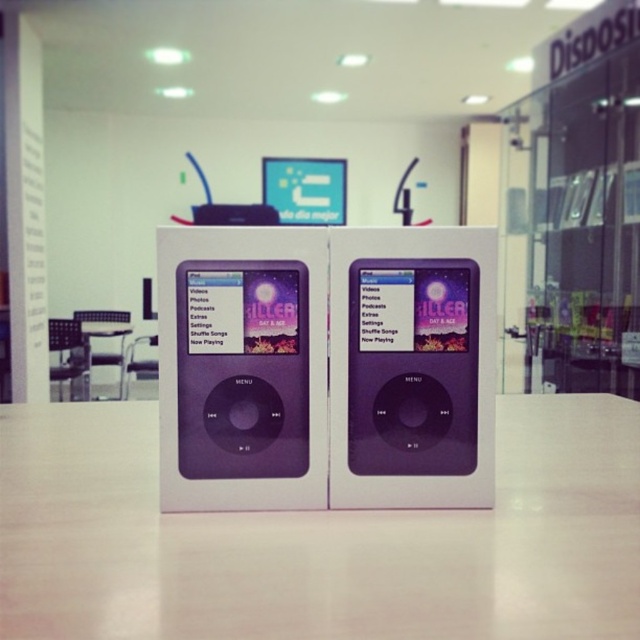
You are a delivery person who just received a package containing a purple glossy ipod at center and a white glossy table at lower center. You need to place both items on a shelf. Which item should you place first to ensure proper positioning according to the image?

The purple glossy ipod at center is above the white glossy table at lower center in the image, so you should place the white glossy table at lower center first on the shelf to replicate the positioning correctly.

You are setting up a display and need to place a decorative mat that is 12 inches wide. You have the white matte table at center and the purple glossy ipod at center in view. Which object can the mat fit over without overhanging?

The white matte table at center is wider than the purple glossy ipod at center. Since the mat is 12 inches wide, it can fit over the white matte table at center as it has sufficient width.

You are setting up a display for an electronics store and need to stack items vertically. You have a purple glossy ipod at center and a white glossy table at lower center. Which item should you place at the bottom of the stack to ensure stability?

The white glossy table at lower center should be placed at the bottom of the stack because it is thicker than the purple glossy ipod at center, providing a stable base.